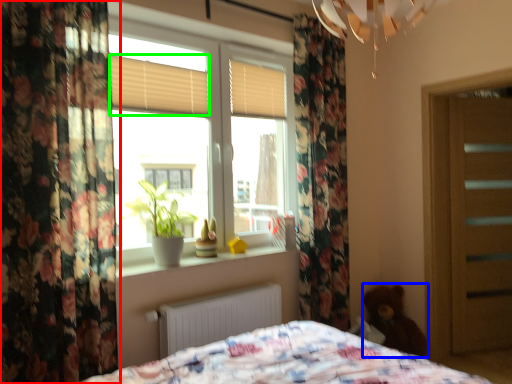
Question: Considering the real-world distances, which object is farthest from curtain (highlighted by a red box)? teddy (highlighted by a blue box) or shutter (highlighted by a green box)?

Choices:
 (A) teddy
 (B) shutter

Answer: (A)